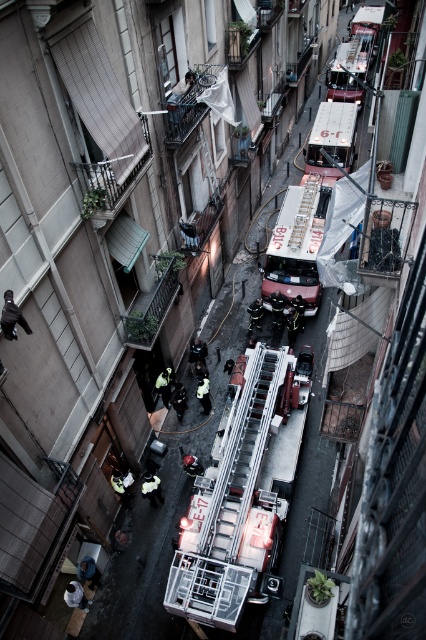
Who is positioned more to the right, metallic silver fire truck at center or metallic red fire truck at center?

From the viewer's perspective, metallic red fire truck at center appears more on the right side.

Which is in front, point (268, 493) or point (345, 148)?

Point (268, 493) is more forward.

Which is in front, point (268, 589) or point (313, 195)?

Point (268, 589)

Where is `metallic silver fire truck at center`? The image size is (426, 640). metallic silver fire truck at center is located at coordinates (241, 497).

Is metallic red fire truck at center above metallic silver ladder at center?

Yes, metallic red fire truck at center is above metallic silver ladder at center.

Does point (319, 202) lie behind point (302, 236)?

Yes.

You are a GUI agent. You are given a task and a screenshot of the screen. Output one action in this format:
    pyautogui.click(x=<x>, y=<y>)
    Task: Click on the metallic red fire truck at center
    This screenshot has height=640, width=426.
    Given the screenshot: What is the action you would take?
    pos(293,262)

Does metallic silver fire truck at center appear on the right side of metallic silver ladder at center?

Incorrect, metallic silver fire truck at center is not on the right side of metallic silver ladder at center.

Is metallic silver fire truck at center positioned behind metallic silver ladder at center?

That is False.

Between point (250, 385) and point (307, 200), which one is positioned behind?

The point (307, 200) is behind.

You are a GUI agent. You are given a task and a screenshot of the screen. Output one action in this format:
    pyautogui.click(x=<x>, y=<y>)
    Task: Click on the metallic silver fire truck at center
    This screenshot has height=640, width=426.
    Given the screenshot: What is the action you would take?
    pyautogui.click(x=241, y=497)